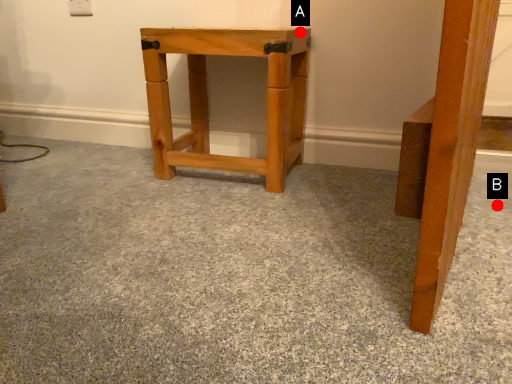
Question: Two points are circled on the image, labeled by A and B beside each circle. Which of the following is the farthest from the observer?

Choices:
 (A) A is further
 (B) B is further

Answer: (A)